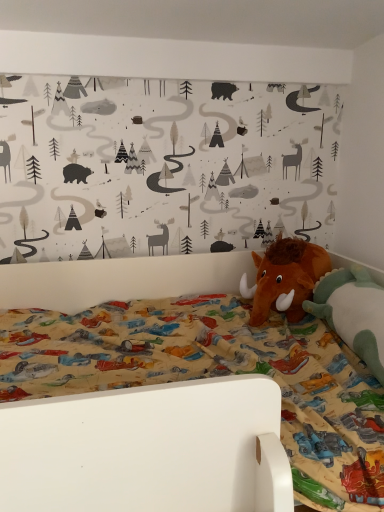
Where is `brown plush mammoth at right, placed as the 1th toy when sorted from back to front`? The height and width of the screenshot is (512, 384). brown plush mammoth at right, placed as the 1th toy when sorted from back to front is located at coordinates (285, 278).

What do you see at coordinates (285, 278) in the screenshot? Image resolution: width=384 pixels, height=512 pixels. I see `brown plush mammoth at right, placed as the 1th toy when sorted from back to front` at bounding box center [285, 278].

What are the coordinates of `brown plush mammoth at right, the second toy when ordered from back to front` in the screenshot? It's located at (353, 313).

Describe the element at coordinates (353, 313) in the screenshot. This screenshot has width=384, height=512. I see `brown plush mammoth at right, the second toy when ordered from back to front` at that location.

Find the location of a particular element. The image size is (384, 512). brown plush mammoth at right, the 2th toy viewed from the front is located at coordinates (285, 278).

Considering the relative positions of brown plush mammoth at right, the 2th toy viewed from the front, and brown plush mammoth at right, the second toy when ordered from back to front, in the image provided, is brown plush mammoth at right, the 2th toy viewed from the front, to the left or to the right of brown plush mammoth at right, the second toy when ordered from back to front,?

Based on their positions, brown plush mammoth at right, the 2th toy viewed from the front, is located to the left of brown plush mammoth at right, the second toy when ordered from back to front.

Relative to brown plush mammoth at right, the second toy when ordered from back to front, is brown plush mammoth at right, the 2th toy viewed from the front, in front or behind?

brown plush mammoth at right, the 2th toy viewed from the front, is behind brown plush mammoth at right, the second toy when ordered from back to front.

Considering the points (279, 252) and (361, 346), which point is in front, point (279, 252) or point (361, 346)?

Positioned in front is point (361, 346).

From the image's perspective, which one is positioned higher, brown plush mammoth at right, the 2th toy viewed from the front, or brown plush mammoth at right, the 1th toy from the front?

From the image's view, brown plush mammoth at right, the 2th toy viewed from the front, is above.

From a real-world perspective, which is physically below, brown plush mammoth at right, the 2th toy viewed from the front, or brown plush mammoth at right, the second toy when ordered from back to front?

brown plush mammoth at right, the second toy when ordered from back to front, from a real-world perspective.

Looking at their sizes, would you say brown plush mammoth at right, placed as the 1th toy when sorted from back to front, is wider or thinner than brown plush mammoth at right, the second toy when ordered from back to front?

In the image, brown plush mammoth at right, placed as the 1th toy when sorted from back to front, appears to be wider than brown plush mammoth at right, the second toy when ordered from back to front.

Considering the sizes of objects brown plush mammoth at right, the 2th toy viewed from the front, and brown plush mammoth at right, the 1th toy from the front, in the image provided, who is shorter, brown plush mammoth at right, the 2th toy viewed from the front, or brown plush mammoth at right, the 1th toy from the front,?

brown plush mammoth at right, the 1th toy from the front.

Does brown plush mammoth at right, the 2th toy viewed from the front, have a smaller size compared to brown plush mammoth at right, the 1th toy from the front?

Correct, brown plush mammoth at right, the 2th toy viewed from the front, occupies less space than brown plush mammoth at right, the 1th toy from the front.

Which is correct: brown plush mammoth at right, placed as the 1th toy when sorted from back to front, is inside brown plush mammoth at right, the second toy when ordered from back to front, or outside of it?

brown plush mammoth at right, placed as the 1th toy when sorted from back to front, is spatially situated outside brown plush mammoth at right, the second toy when ordered from back to front.

Is brown plush mammoth at right, the 2th toy viewed from the front, positioned far away from brown plush mammoth at right, the second toy when ordered from back to front?

They are positioned close to each other.

Is brown plush mammoth at right, the 2th toy viewed from the front, facing towards brown plush mammoth at right, the 1th toy from the front?

Yes, brown plush mammoth at right, the 2th toy viewed from the front, is aimed at brown plush mammoth at right, the 1th toy from the front.

What's the angular difference between brown plush mammoth at right, placed as the 1th toy when sorted from back to front, and brown plush mammoth at right, the second toy when ordered from back to front,'s facing directions?

94.6 degrees separate the facing orientations of brown plush mammoth at right, placed as the 1th toy when sorted from back to front, and brown plush mammoth at right, the second toy when ordered from back to front.

At what (x,y) coordinates should I click in order to perform the action: click on toy on the right side of brown plush mammoth at right, the 2th toy viewed from the front. Please return your answer as a coordinate pair (x, y). The width and height of the screenshot is (384, 512). Looking at the image, I should click on (353, 313).

Between brown plush mammoth at right, the second toy when ordered from back to front, and brown plush mammoth at right, the 2th toy viewed from the front, which one appears on the left side from the viewer's perspective?

Positioned to the left is brown plush mammoth at right, the 2th toy viewed from the front.

Looking at this image, is the position of brown plush mammoth at right, the second toy when ordered from back to front, more distant than that of brown plush mammoth at right, placed as the 1th toy when sorted from back to front?

No, it is in front of brown plush mammoth at right, placed as the 1th toy when sorted from back to front.

Which is less distant, (x=333, y=308) or (x=279, y=261)?

The point (x=333, y=308) is more forward.

From the image's perspective, is brown plush mammoth at right, the 1th toy from the front, under brown plush mammoth at right, placed as the 1th toy when sorted from back to front?

Correct, brown plush mammoth at right, the 1th toy from the front, appears lower than brown plush mammoth at right, placed as the 1th toy when sorted from back to front, in the image.

From a real-world perspective, is brown plush mammoth at right, the 1th toy from the front, above or below brown plush mammoth at right, the 2th toy viewed from the front?

brown plush mammoth at right, the 1th toy from the front, is situated lower than brown plush mammoth at right, the 2th toy viewed from the front, in the real world.

Which object is thinner, brown plush mammoth at right, the 1th toy from the front, or brown plush mammoth at right, the 2th toy viewed from the front?

brown plush mammoth at right, the 1th toy from the front.

Is brown plush mammoth at right, the 1th toy from the front, taller or shorter than brown plush mammoth at right, placed as the 1th toy when sorted from back to front?

Considering their sizes, brown plush mammoth at right, the 1th toy from the front, has less height than brown plush mammoth at right, placed as the 1th toy when sorted from back to front.

Between brown plush mammoth at right, the 1th toy from the front, and brown plush mammoth at right, placed as the 1th toy when sorted from back to front, which one has smaller size?

With smaller size is brown plush mammoth at right, placed as the 1th toy when sorted from back to front.

Based on the photo, can we say brown plush mammoth at right, the 1th toy from the front, lies outside brown plush mammoth at right, placed as the 1th toy when sorted from back to front?

Yes, brown plush mammoth at right, the 1th toy from the front, is outside of brown plush mammoth at right, placed as the 1th toy when sorted from back to front.

Is there a large distance between brown plush mammoth at right, the second toy when ordered from back to front, and brown plush mammoth at right, placed as the 1th toy when sorted from back to front?

No.

Is brown plush mammoth at right, placed as the 1th toy when sorted from back to front, at the back of brown plush mammoth at right, the 1th toy from the front?

No, brown plush mammoth at right, the 1th toy from the front, is not facing away from brown plush mammoth at right, placed as the 1th toy when sorted from back to front.

What's the angular difference between brown plush mammoth at right, the 1th toy from the front, and brown plush mammoth at right, placed as the 1th toy when sorted from back to front,'s facing directions?

94.6 degrees.

Locate an element on the screen. The width and height of the screenshot is (384, 512). toy that appears below the brown plush mammoth at right, placed as the 1th toy when sorted from back to front (from a real-world perspective) is located at coordinates (353, 313).

Locate an element on the screen. toy below the brown plush mammoth at right, the 2th toy viewed from the front (from a real-world perspective) is located at coordinates (353, 313).

The height and width of the screenshot is (512, 384). I want to click on toy on the left of brown plush mammoth at right, the second toy when ordered from back to front, so click(x=285, y=278).